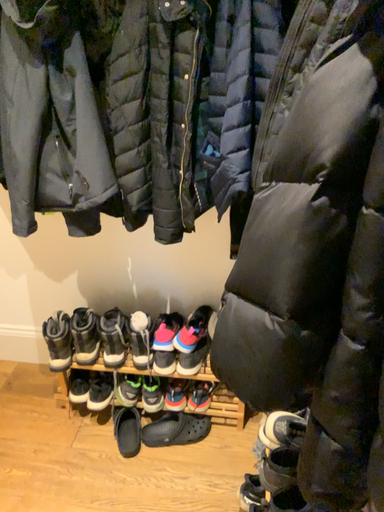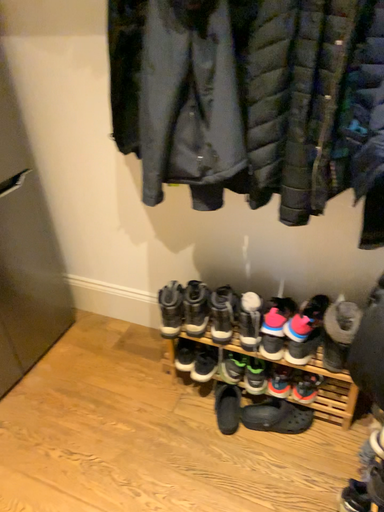
Question: Which way did the camera rotate in the video?

Choices:
 (A) rotated left
 (B) rotated right

Answer: (A)